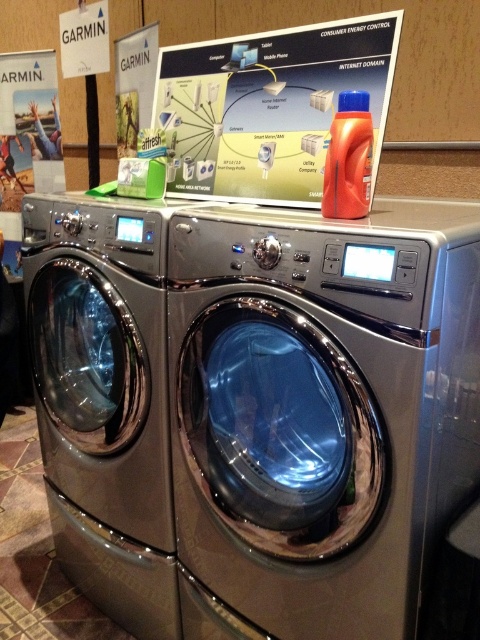
Which is behind, point (27, 211) or point (163, 76)?

Positioned behind is point (163, 76).

The width and height of the screenshot is (480, 640). What are the coordinates of `satin chrome washing machine at left` in the screenshot? It's located at click(x=105, y=397).

What do you see at coordinates (105, 397) in the screenshot? The height and width of the screenshot is (640, 480). I see `satin chrome washing machine at left` at bounding box center [105, 397].

Find the location of `satin chrome washing machine at left`. satin chrome washing machine at left is located at coordinates (105, 397).

Consider the image. Can you confirm if satin silver washing machine at center is smaller than white glossy poster at center?

No.

Find the location of a particular element. The width and height of the screenshot is (480, 640). satin silver washing machine at center is located at coordinates (322, 406).

Can you confirm if satin silver washing machine at center is positioned to the right of satin chrome washing machine at left?

Yes, satin silver washing machine at center is to the right of satin chrome washing machine at left.

Who is shorter, satin silver washing machine at center or satin chrome washing machine at left?

With less height is satin silver washing machine at center.

Find the location of a particular element. This screenshot has width=480, height=640. satin silver washing machine at center is located at coordinates (322, 406).